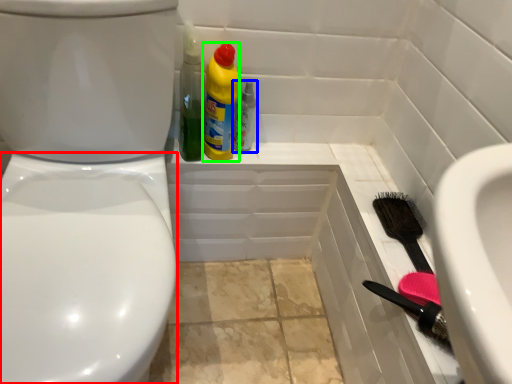
Question: Which is nearer to the bidet (highlighted by a red box)? bottle (highlighted by a blue box) or cleaning product (highlighted by a green box).

Choices:
 (A) bottle
 (B) cleaning product

Answer: (B)